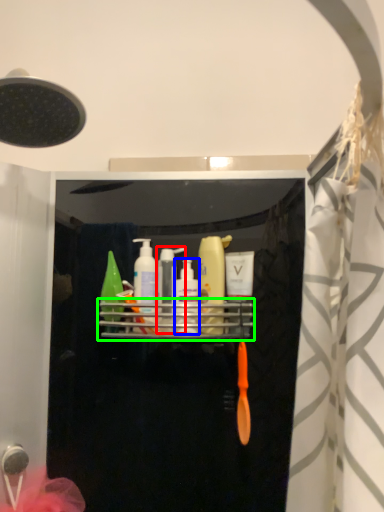
Question: Which object is the closest to the toiletry (highlighted by a red box)? Choose among these: mouthwash (highlighted by a blue box) or shelf (highlighted by a green box).

Choices:
 (A) mouthwash
 (B) shelf

Answer: (A)